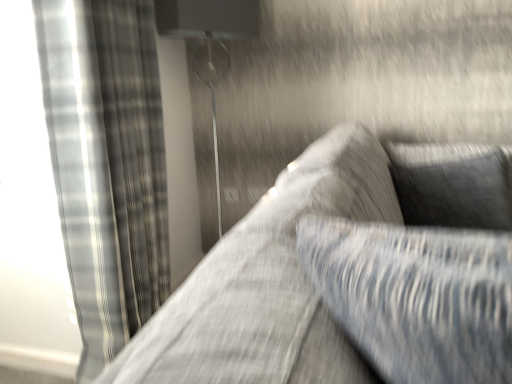
Question: Is textured gray couch at center smaller than black textured pillow at upper right?

Choices:
 (A) no
 (B) yes

Answer: (A)

Question: Is textured gray couch at center thinner than black textured pillow at upper right?

Choices:
 (A) yes
 (B) no

Answer: (B)

Question: Does textured gray couch at center have a larger size compared to black textured pillow at upper right?

Choices:
 (A) yes
 (B) no

Answer: (A)

Question: From the image's perspective, does textured gray couch at center appear lower than black textured pillow at upper right?

Choices:
 (A) yes
 (B) no

Answer: (B)

Question: Is textured gray couch at center facing away from black textured pillow at upper right?

Choices:
 (A) yes
 (B) no

Answer: (B)

Question: From a real-world perspective, is textured gray couch at center physically below black textured pillow at upper right?

Choices:
 (A) no
 (B) yes

Answer: (A)

Question: Is metallic silver lamp at upper center smaller than black textured pillow at upper right?

Choices:
 (A) yes
 (B) no

Answer: (B)

Question: Does metallic silver lamp at upper center have a lesser width compared to black textured pillow at upper right?

Choices:
 (A) no
 (B) yes

Answer: (A)

Question: From a real-world perspective, does metallic silver lamp at upper center sit lower than black textured pillow at upper right?

Choices:
 (A) yes
 (B) no

Answer: (B)

Question: From the image's perspective, would you say metallic silver lamp at upper center is shown under black textured pillow at upper right?

Choices:
 (A) no
 (B) yes

Answer: (A)

Question: Is metallic silver lamp at upper center not close to black textured pillow at upper right?

Choices:
 (A) yes
 (B) no

Answer: (A)

Question: Considering the relative sizes of metallic silver lamp at upper center and black textured pillow at upper right in the image provided, is metallic silver lamp at upper center bigger than black textured pillow at upper right?

Choices:
 (A) yes
 (B) no

Answer: (A)

Question: Would you say metallic silver lamp at upper center is a long distance from plaid fabric curtain at left?

Choices:
 (A) yes
 (B) no

Answer: (B)